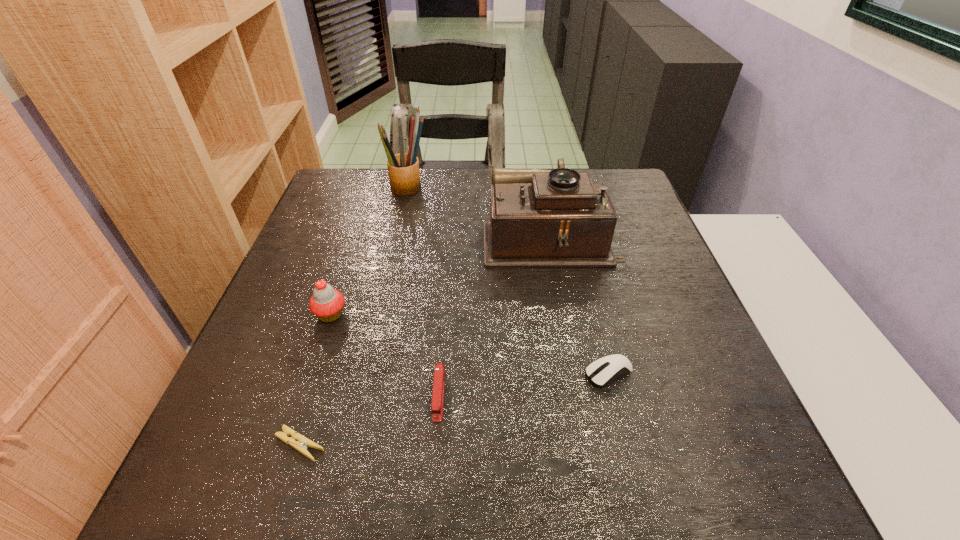
Locate an element on the screen. pencil box is located at coordinates (403, 169).

Where is `phonograph_record`? This screenshot has width=960, height=540. phonograph_record is located at coordinates (558, 218).

Identify the location of cupcake. This screenshot has height=540, width=960. (326, 303).

Find the location of a particular element. The image size is (960, 540). the third tallest object is located at coordinates (326, 303).

At what (x,y) coordinates should I click in order to perform the action: click on stapler. Please return your answer as a coordinate pair (x, y). Image resolution: width=960 pixels, height=540 pixels. Looking at the image, I should click on (437, 402).

The width and height of the screenshot is (960, 540). Find the location of `the third object from right to left`. the third object from right to left is located at coordinates (x=437, y=402).

Identify the location of mouse. Image resolution: width=960 pixels, height=540 pixels. (605, 370).

Locate an element on the screen. This screenshot has height=540, width=960. the nearest object is located at coordinates (301, 446).

Where is `clothespin`? The height and width of the screenshot is (540, 960). clothespin is located at coordinates (301, 446).

The image size is (960, 540). Identify the location of free space located on the right of the farthest object. (543, 190).